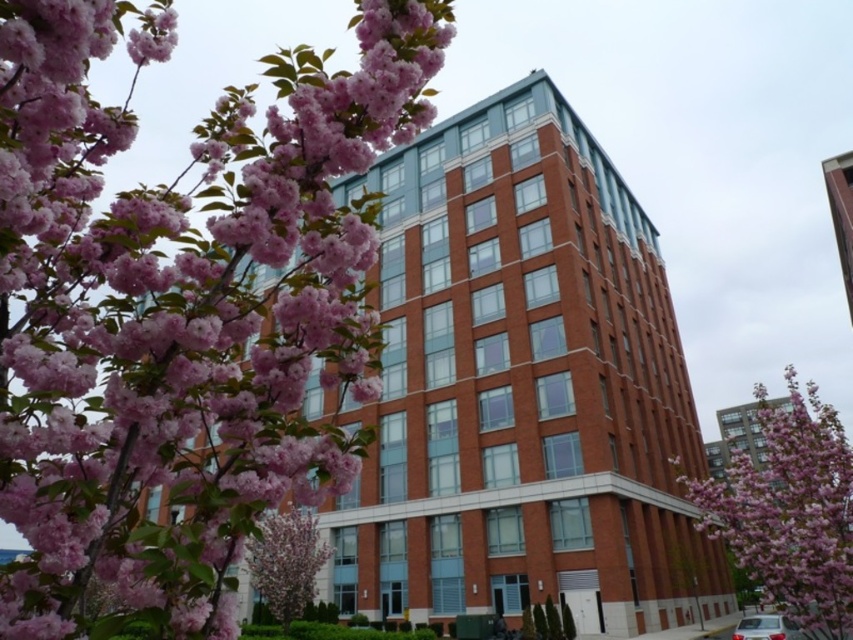
Question: Considering the real-world distances, which object is closest to the pink matte blossoms at upper left?

Choices:
 (A) pink bloom tree at lower left
 (B) metallic silver car at lower right
 (C) pink bloom at center

Answer: (A)

Question: Which object is the farthest from the metallic silver car at lower right?

Choices:
 (A) pink bloom at center
 (B) pink matte blossoms at upper left
 (C) pink bloom tree at lower left

Answer: (B)

Question: Considering the relative positions of pink bloom at center and metallic silver car at lower right in the image provided, where is pink bloom at center located with respect to metallic silver car at lower right?

Choices:
 (A) below
 (B) above

Answer: (A)

Question: Does pink matte blossoms at upper left come behind pink bloom at center?

Choices:
 (A) yes
 (B) no

Answer: (B)

Question: In this image, where is pink matte blossoms at upper left located relative to pink bloom at center?

Choices:
 (A) below
 (B) above

Answer: (B)

Question: Which object appears closest to the camera in this image?

Choices:
 (A) metallic silver car at lower right
 (B) pink bloom at center
 (C) pink bloom tree at lower left
 (D) pink matte blossoms at upper left

Answer: (D)